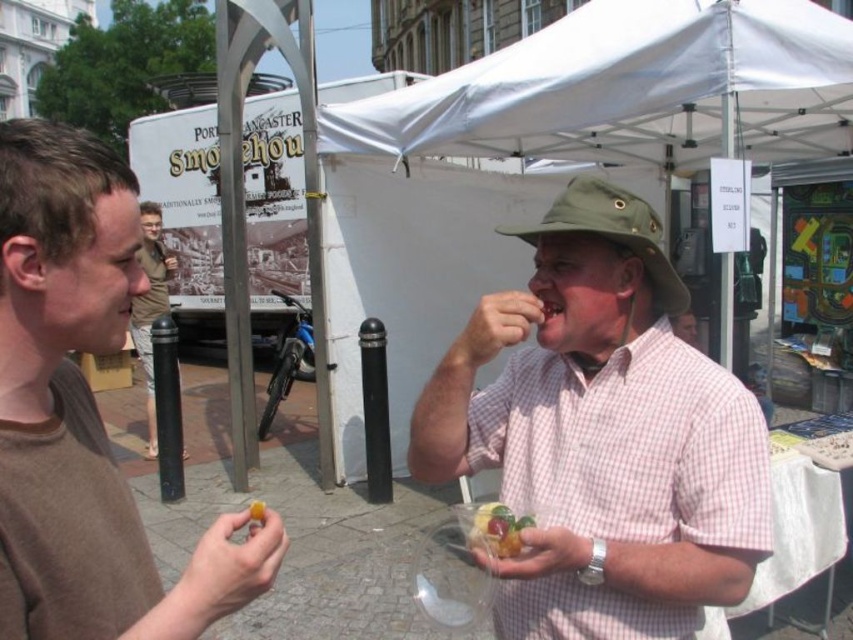
Is pink checkered shirt at center positioned at the back of light brown fabric shirt at left?

No.

Find the location of a particular element. pink checkered shirt at center is located at coordinates (602, 435).

Does point (621, 307) come behind point (161, 284)?

No, (621, 307) is closer to viewer.

This screenshot has height=640, width=853. In order to click on pink checkered shirt at center in this screenshot , I will do `click(602, 435)`.

Where is `brown matte shirt at left`? This screenshot has height=640, width=853. brown matte shirt at left is located at coordinates (85, 413).

Who is more forward, [39,532] or [135,300]?

Point [39,532] is more forward.

Which is in front, point (119, 566) or point (132, 310)?

Point (119, 566)

Find the location of a particular element. The height and width of the screenshot is (640, 853). brown matte shirt at left is located at coordinates (85, 413).

Identify the location of white fabric canopy at upper center. Image resolution: width=853 pixels, height=640 pixels. (627, 88).

From the picture: Who is more distant from viewer, (825, 88) or (532, 516)?

Point (825, 88)

The image size is (853, 640). Identify the location of white fabric canopy at upper center. (627, 88).